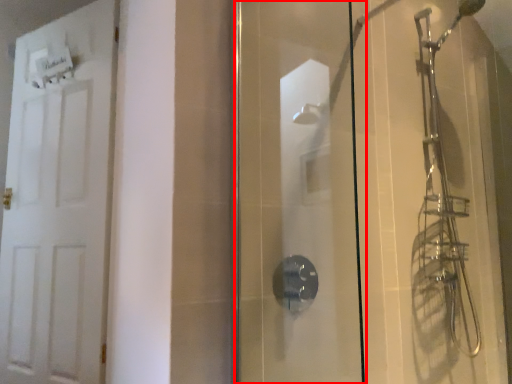
Question: Where is screen door (annotated by the red box) located in relation to door in the image?

Choices:
 (A) left
 (B) right

Answer: (B)